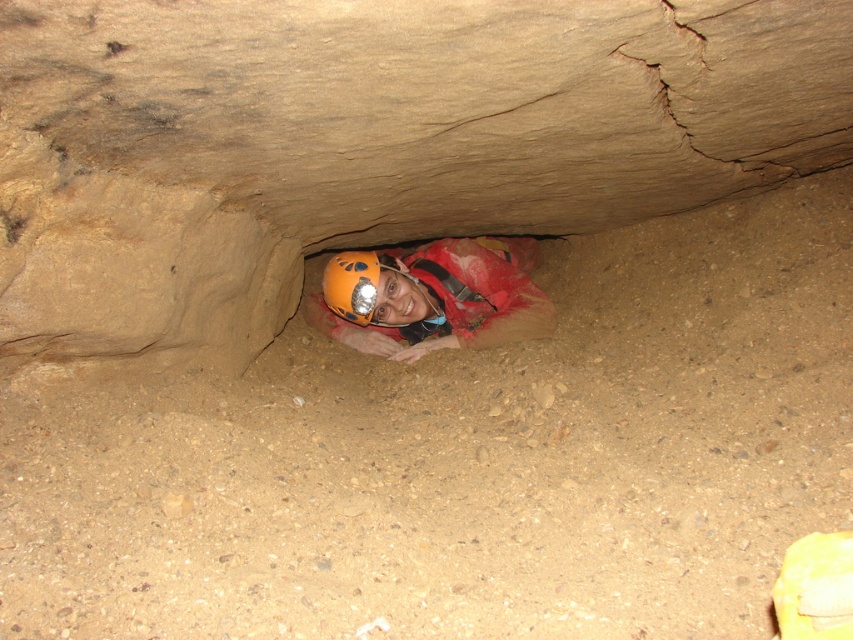
Question: Does orange helmet at center appear on the left side of orange matte helmet at center?

Choices:
 (A) yes
 (B) no

Answer: (B)

Question: Which of the following is the farthest from the observer?

Choices:
 (A) (370, 330)
 (B) (328, 282)

Answer: (A)

Question: Is orange helmet at center wider than orange matte helmet at center?

Choices:
 (A) no
 (B) yes

Answer: (B)

Question: Which point appears farthest from the camera in this image?

Choices:
 (A) (347, 316)
 (B) (496, 323)

Answer: (A)

Question: Can you confirm if orange helmet at center is positioned to the right of orange matte helmet at center?

Choices:
 (A) yes
 (B) no

Answer: (A)